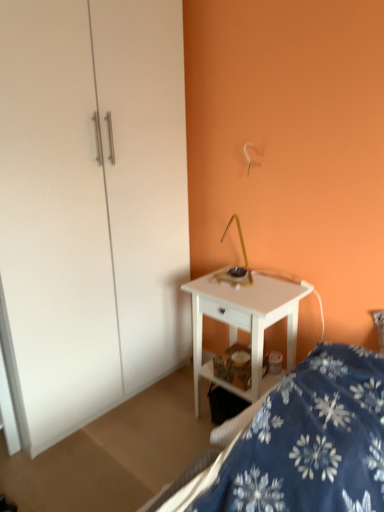
This screenshot has width=384, height=512. I want to click on free space above blue floral fabric bed at lower right (from a real-world perspective), so click(x=326, y=394).